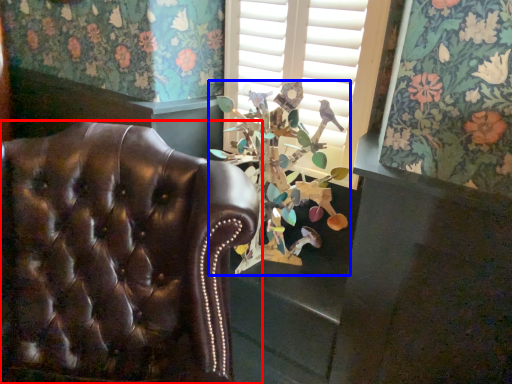
Question: Which point is further to the camera, chair (highlighted by a red box) or floral arrangement (highlighted by a blue box)?

Choices:
 (A) chair
 (B) floral arrangement

Answer: (B)